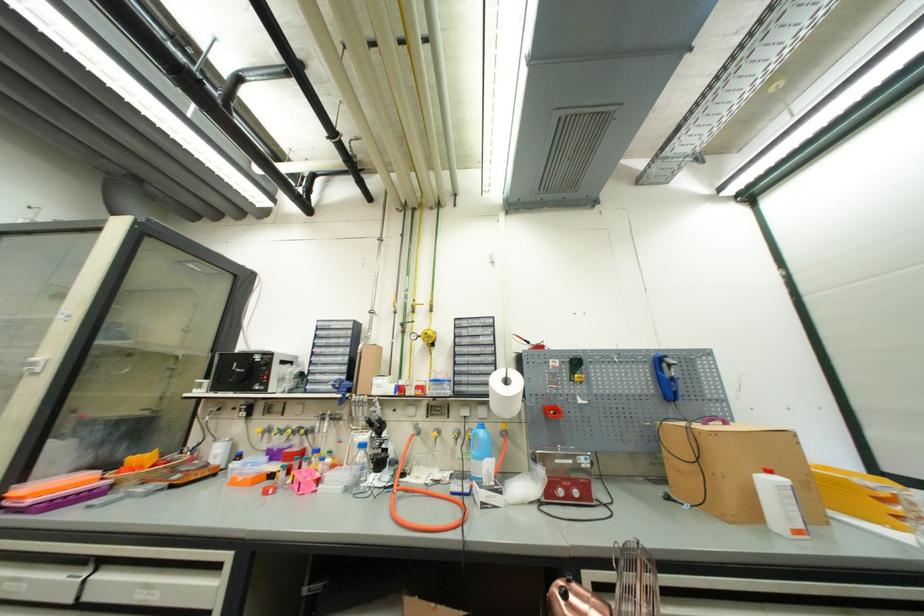
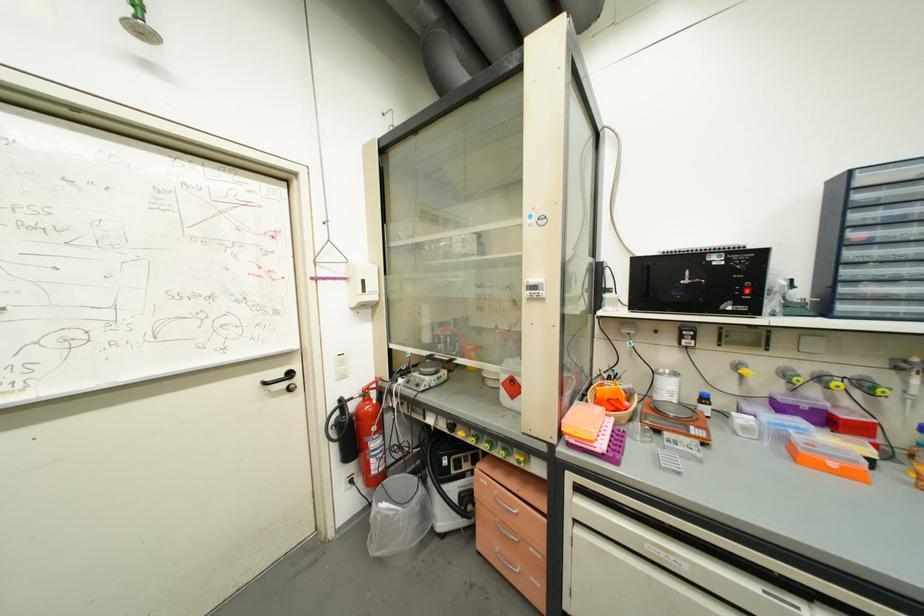
Find the pixel in the second image that matches point 262,390 in the first image.

(735, 310)